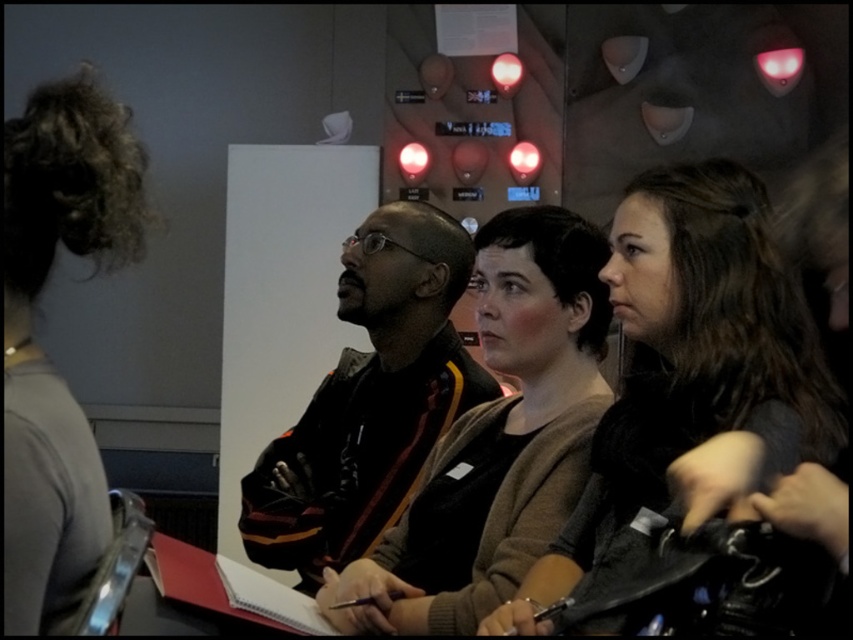
Is dark brown hair at center further to camera compared to matte black sweater at center?

No, it is in front of matte black sweater at center.

Who is more forward, (712, 268) or (387, 560)?

Point (712, 268) is more forward.

Where is `dark brown hair at center`? dark brown hair at center is located at coordinates (689, 380).

Does matte black sweater at center appear over dark brown leather jacket at center?

Incorrect, matte black sweater at center is not positioned above dark brown leather jacket at center.

Is point (490, 554) farther from camera compared to point (325, 490)?

That is False.

Locate an element on the screen. matte black sweater at center is located at coordinates (497, 440).

The width and height of the screenshot is (853, 640). What are the coordinates of `dark brown hair at center` in the screenshot? It's located at (689, 380).

Does dark brown hair at center have a lesser width compared to dark brown leather jacket at center?

Yes.

What do you see at coordinates (689, 380) in the screenshot?
I see `dark brown hair at center` at bounding box center [689, 380].

This screenshot has width=853, height=640. I want to click on dark brown hair at center, so click(689, 380).